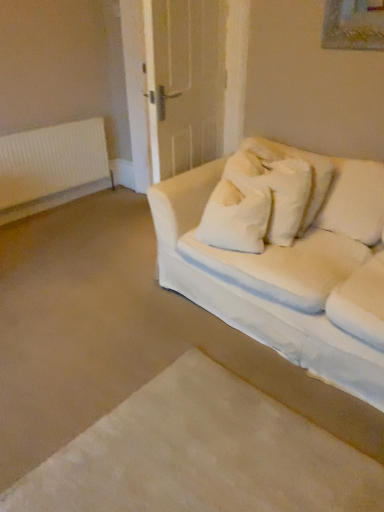
Locate an element on the screen. The width and height of the screenshot is (384, 512). empty space that is ontop of white soft carpet at lower left (from a real-world perspective) is located at coordinates (212, 460).